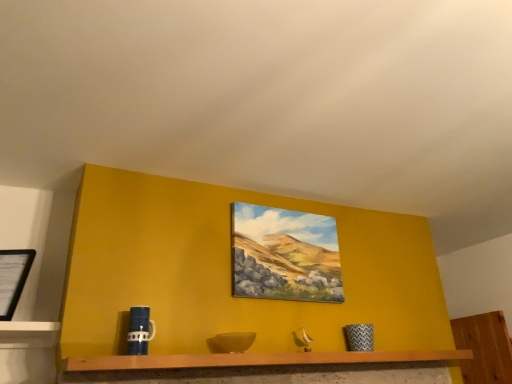
Question: Is black matte picture frame at left, the first picture frame positioned from the front, bigger or smaller than blue matte mug at lower left?

Choices:
 (A) small
 (B) big

Answer: (B)

Question: Visually, is black matte picture frame at left, acting as the second picture frame starting from the right, positioned to the left or to the right of blue matte mug at lower left?

Choices:
 (A) left
 (B) right

Answer: (A)

Question: Which is farther from the matte canvas painting at center, the second picture frame in the front-to-back sequence?

Choices:
 (A) wooden shelf at center
 (B) black matte picture frame at left, the 1th picture frame viewed from the left
 (C) blue matte mug at lower left

Answer: (B)

Question: Estimate the real-world distances between objects in this image. Which object is farther from the blue matte mug at lower left?

Choices:
 (A) wooden shelf at center
 (B) matte canvas painting at center, which ranks as the 1th picture frame in right-to-left order
 (C) black matte picture frame at left, the 1th picture frame viewed from the left

Answer: (B)